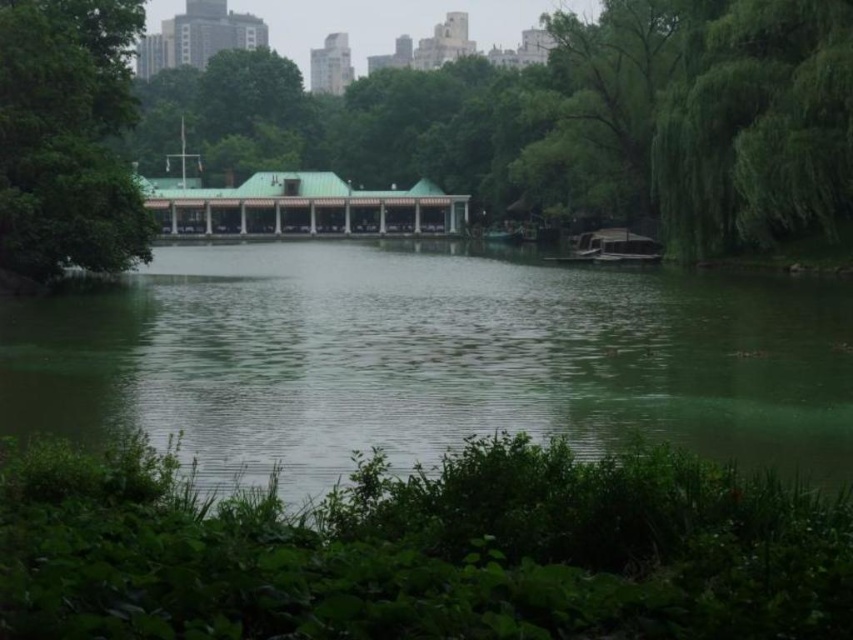
You are standing at the edge of the lake and want to take a photo of the green leafy tree at left and the green smooth water at center. If your camera has a maximum focus range of 30 feet, will you be able to capture both subjects clearly in the same frame without moving closer?

The green smooth water at center is 35.56 feet away from the green leafy tree at left. Since the distance between them exceeds the camera maximum focus range of 30 feet, you won not be able to capture both subjects clearly in the same frame without moving closer.